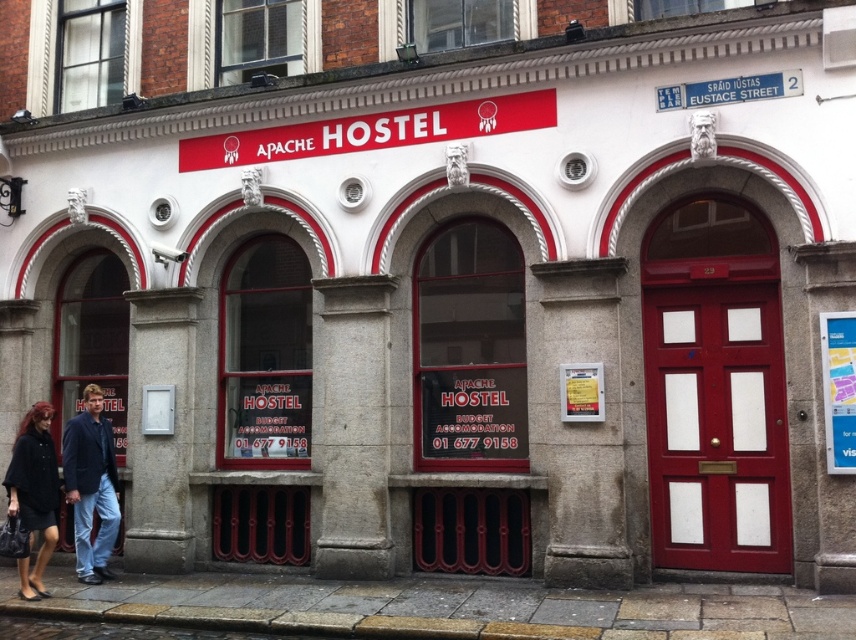
Question: Is dark blue denim jeans at lower left wider than blue denim jeans at lower left?

Choices:
 (A) no
 (B) yes

Answer: (B)

Question: Is brown stone pavement at lower center to the left of blue denim jeans at lower left from the viewer's perspective?

Choices:
 (A) yes
 (B) no

Answer: (B)

Question: Considering the relative positions of brown stone pavement at lower center and black fabric coat at lower left in the image provided, where is brown stone pavement at lower center located with respect to black fabric coat at lower left?

Choices:
 (A) above
 (B) below

Answer: (B)

Question: Which point is closer to the camera taking this photo?

Choices:
 (A) (24, 486)
 (B) (120, 605)

Answer: (B)

Question: Which is nearer to the brown stone pavement at lower center?

Choices:
 (A) dark blue denim jeans at lower left
 (B) black fabric coat at lower left
 (C) blue denim jeans at lower left

Answer: (A)

Question: Which point is farther to the camera?

Choices:
 (A) blue denim jeans at lower left
 (B) brown stone pavement at lower center
 (C) black fabric coat at lower left

Answer: (A)